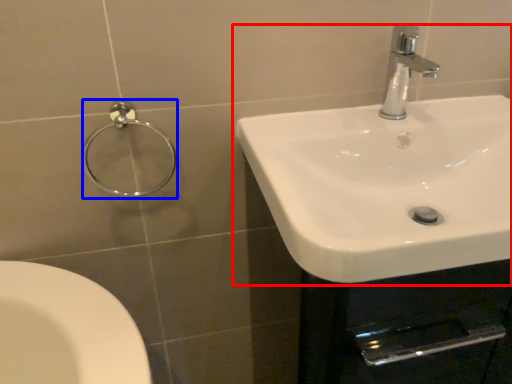
Question: Which object is closer to the camera taking this photo, sink (highlighted by a red box) or shower (highlighted by a blue box)?

Choices:
 (A) sink
 (B) shower

Answer: (A)